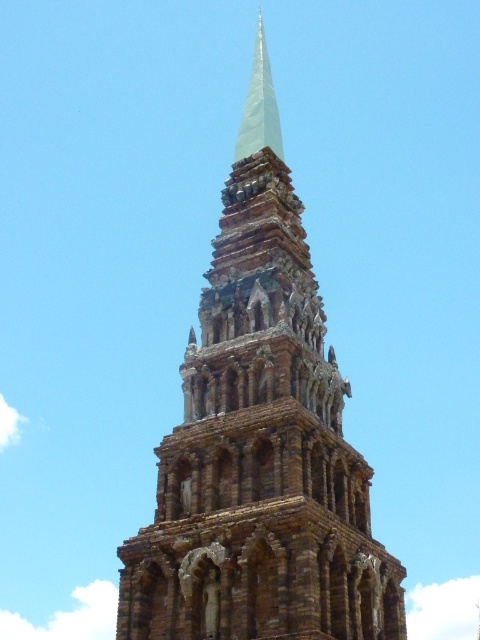
Is brown stone tower at center taller than white glass spire at center?

No.

Is point (313, 502) positioned behind point (260, 83)?

No, it is in front of (260, 83).

This screenshot has height=640, width=480. Find the location of `brown stone tower at center`. brown stone tower at center is located at coordinates (260, 456).